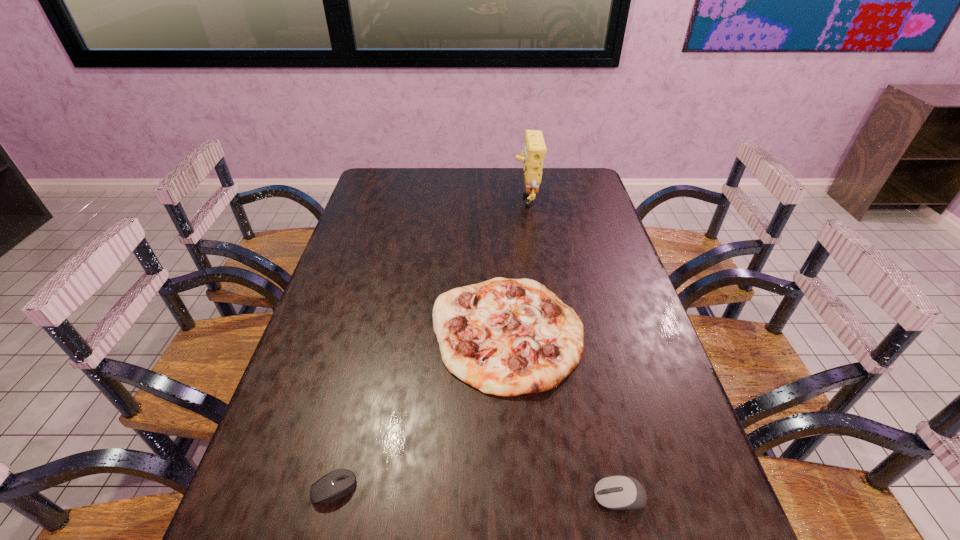
This screenshot has width=960, height=540. In order to click on vacant region between the shortest object and the third shortest object in this screenshot , I will do `click(420, 410)`.

Locate which object is the second closest to the second shortest object. Please provide its 2D coordinates. Your answer should be formatted as a tuple, i.e. [(x, y)], where the tuple contains the x and y coordinates of a point satisfying the conditions above.

[(337, 484)]

Find the location of a particular element. Image resolution: width=960 pixels, height=540 pixels. object identified as the third closest to the tallest object is located at coordinates (337, 484).

Where is `free space that satisfies the following two spatial constraints: 1. on the back side of the second farthest object; 2. on the right side of the shorter computer equipment`? The height and width of the screenshot is (540, 960). free space that satisfies the following two spatial constraints: 1. on the back side of the second farthest object; 2. on the right side of the shorter computer equipment is located at coordinates (372, 332).

Image resolution: width=960 pixels, height=540 pixels. I want to click on free space that satisfies the following two spatial constraints: 1. on the face of the tallest object; 2. on the front side of the second farthest object, so click(x=545, y=332).

Identify the location of vacant region that satisfies the following two spatial constraints: 1. on the face of the tallest object; 2. on the front side of the leftmost object. (568, 489).

You are a GUI agent. You are given a task and a screenshot of the screen. Output one action in this format:
    pyautogui.click(x=<x>, y=<y>)
    Task: Click on the vacant point that satisfies the following two spatial constraints: 1. on the face of the tallest object; 2. on the front side of the second tallest object
    
    Given the screenshot: What is the action you would take?
    pyautogui.click(x=545, y=332)

This screenshot has height=540, width=960. I want to click on free region that satisfies the following two spatial constraints: 1. on the face of the farthest object; 2. on the front side of the pizza, so click(545, 332).